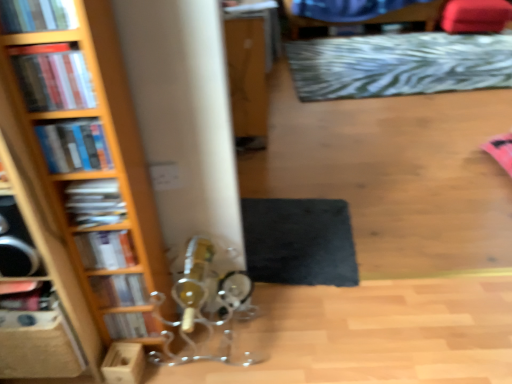
Question: Is hardcover book at upper left, which is the 7th book in bottom-to-top order, facing towards black felt mat at lower center, placed as the first mat when sorted from left to right?

Choices:
 (A) yes
 (B) no

Answer: (B)

Question: Does hardcover book at upper left, marked as the 7th book in a back-to-front arrangement, appear on the right side of black felt mat at lower center, which is counted as the 2th mat, starting from the right?

Choices:
 (A) no
 (B) yes

Answer: (A)

Question: From the image's perspective, is hardcover book at upper left, which is counted as the first book, starting from the top, below black felt mat at lower center, which is counted as the 2th mat, starting from the right?

Choices:
 (A) yes
 (B) no

Answer: (B)

Question: Does hardcover book at upper left, marked as the first book in a front-to-back arrangement, have a larger size compared to black felt mat at lower center, the 1th mat in the front-to-back sequence?

Choices:
 (A) no
 (B) yes

Answer: (A)

Question: Is the position of hardcover book at upper left, which is counted as the first book, starting from the top, more distant than that of black felt mat at lower center, which is the 2th mat from back to front?

Choices:
 (A) no
 (B) yes

Answer: (A)

Question: From a real-world perspective, does hardcover book at upper left, which is the 7th book in bottom-to-top order, stand above black felt mat at lower center, which is the 2th mat from back to front?

Choices:
 (A) no
 (B) yes

Answer: (B)

Question: From a real-world perspective, is matte black book at left, arranged as the 4th book when viewed from the front, over hardcover books at left, positioned as the fifth book in bottom-to-top order?

Choices:
 (A) yes
 (B) no

Answer: (B)

Question: From the image's perspective, does matte black book at left, arranged as the 4th book when viewed from the front, appear higher than hardcover books at left, positioned as the fifth book in bottom-to-top order?

Choices:
 (A) yes
 (B) no

Answer: (B)

Question: Is matte black book at left, arranged as the 4th book when viewed from the front, facing towards hardcover books at left, positioned as the fifth book in bottom-to-top order?

Choices:
 (A) yes
 (B) no

Answer: (B)

Question: Considering the relative positions of matte black book at left, placed as the fourth book when sorted from bottom to top, and hardcover books at left, the third book from the front, in the image provided, is matte black book at left, placed as the fourth book when sorted from bottom to top, to the left of hardcover books at left, the third book from the front, from the viewer's perspective?

Choices:
 (A) yes
 (B) no

Answer: (B)

Question: Is matte black book at left, arranged as the 4th book when viewed from the front, not near hardcover books at left, the third book from the front?

Choices:
 (A) yes
 (B) no

Answer: (B)

Question: Considering the relative sizes of matte black book at left, which is the 4th book from top to bottom, and hardcover books at left, the third book from the front, in the image provided, is matte black book at left, which is the 4th book from top to bottom, shorter than hardcover books at left, the third book from the front,?

Choices:
 (A) no
 (B) yes

Answer: (B)

Question: Are hardcover book at left, the sixth book positioned from the front, and wooden bookcase at left beside each other?

Choices:
 (A) yes
 (B) no

Answer: (B)